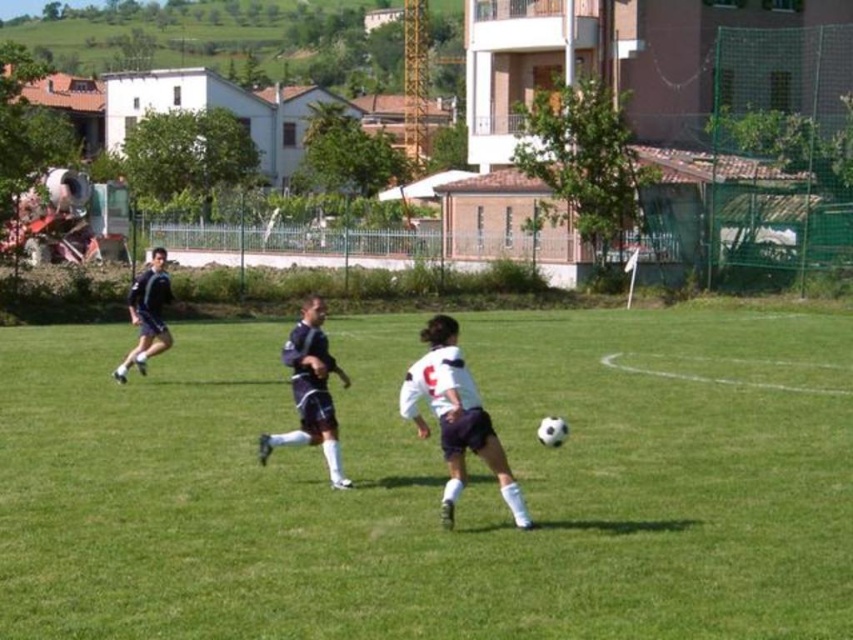
You are a photographer standing at the edge of the soccer field. You want to take a photo that includes both the point at position (322, 552) and the point at position (160, 324). Which point should you focus on first to ensure both are in sharp focus?

You should focus on point (160, 324) first because it is farther from the camera than point (322, 552). By focusing on the farther point, the closer point will also be within the depth of field, ensuring both are in sharp focus.

You are a soccer referee observing the match. You need to determine the direction of play. Which player is positioned to the right side of the other between the white matte jersey at center and the dark blue jersey at center?

The white matte jersey at center is positioned to the right of the dark blue jersey at center.